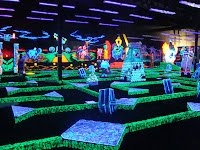
Where is `statue`? The image size is (200, 150). statue is located at coordinates (129, 69), (186, 62), (117, 61).